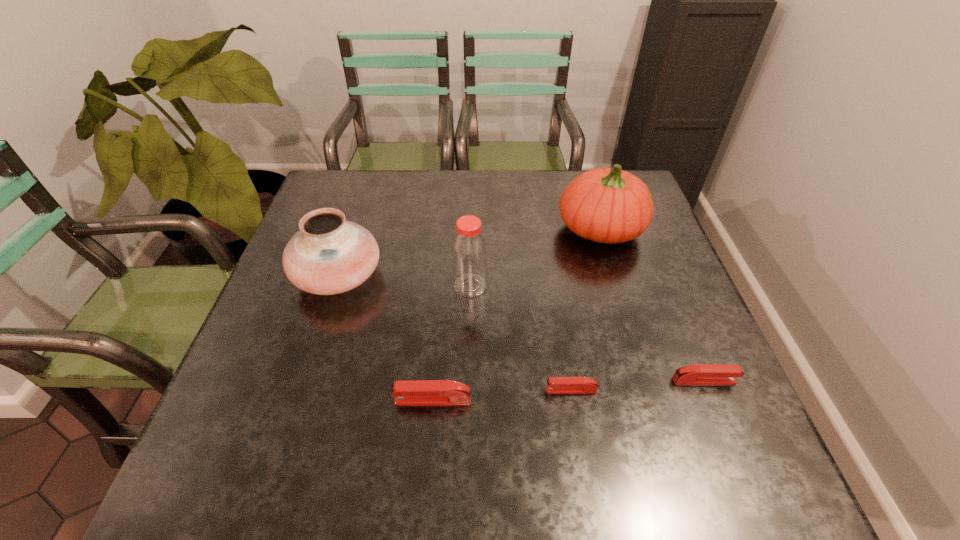
Observe the arrangement of all staplers in the image. To keep them evenly spaced, where would you place another stapler on the left? Please locate a free space. Please provide its 2D coordinates. Your answer should be formatted as a tuple, i.e. [(x, y)], where the tuple contains the x and y coordinates of a point satisfying the conditions above.

[(291, 410)]